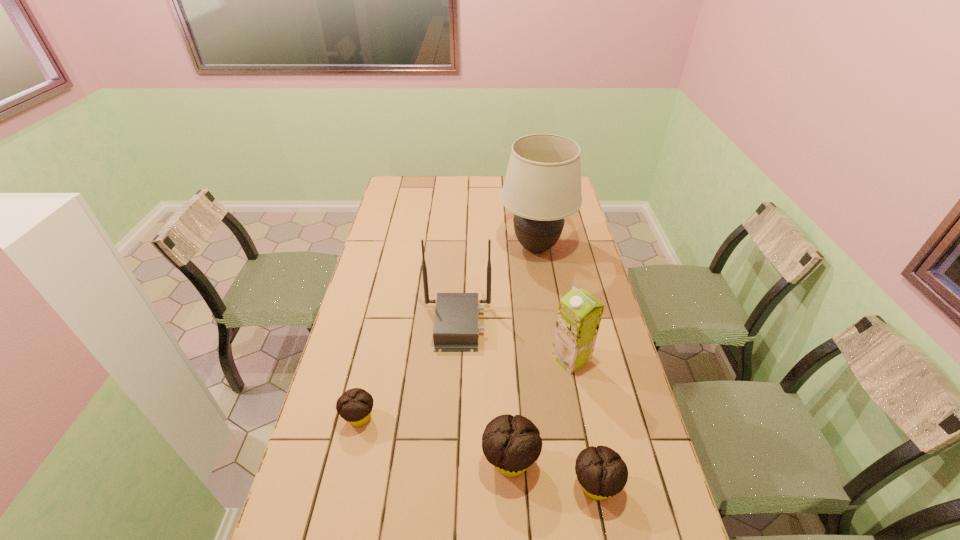
You are a GUI agent. You are given a task and a screenshot of the screen. Output one action in this format:
    pyautogui.click(x=<x>, y=<y>)
    Task: Click on the vacant area that lies between the shortest muffin and the soya milk
    The height and width of the screenshot is (540, 960).
    Given the screenshot: What is the action you would take?
    pyautogui.click(x=465, y=388)

I want to click on empty space between the tallest object and the third shortest object, so click(523, 354).

Locate an element on the screen. The height and width of the screenshot is (540, 960). vacant space that's between the farthest muffin and the second shortest object is located at coordinates pyautogui.click(x=477, y=451).

Where is `free spot between the tallest muffin and the rightmost muffin`? The width and height of the screenshot is (960, 540). free spot between the tallest muffin and the rightmost muffin is located at coordinates (553, 473).

Where is `unoccupied area between the shortest muffin and the soya milk`? Image resolution: width=960 pixels, height=540 pixels. unoccupied area between the shortest muffin and the soya milk is located at coordinates (465, 388).

You are a GUI agent. You are given a task and a screenshot of the screen. Output one action in this format:
    pyautogui.click(x=<x>, y=<y>)
    Task: Click on the third closest object relative to the leftmost muffin
    This screenshot has width=960, height=540.
    Given the screenshot: What is the action you would take?
    [602, 473]

Where is `object that stands as the third closest to the router`? Image resolution: width=960 pixels, height=540 pixels. object that stands as the third closest to the router is located at coordinates (355, 406).

This screenshot has width=960, height=540. What are the coordinates of `muffin that is the closest one to the leftmost muffin` in the screenshot? It's located at (512, 444).

This screenshot has height=540, width=960. I want to click on muffin that is the third closest to the router, so click(x=602, y=473).

At what (x,y) coordinates should I click in order to perform the action: click on free space that satisfies the following two spatial constraints: 1. on the back of the tallest muffin to connect cables; 2. on the right side of the router. Please return your answer as a coordinate pair (x, y). The image size is (960, 540). Looking at the image, I should click on coord(450,461).